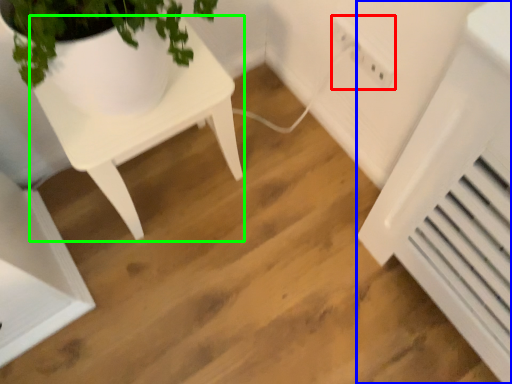
Question: Considering the real-world distances, which object is farthest from electric outlet (highlighted by a red box)? air conditioning (highlighted by a blue box) or table (highlighted by a green box)?

Choices:
 (A) air conditioning
 (B) table

Answer: (B)